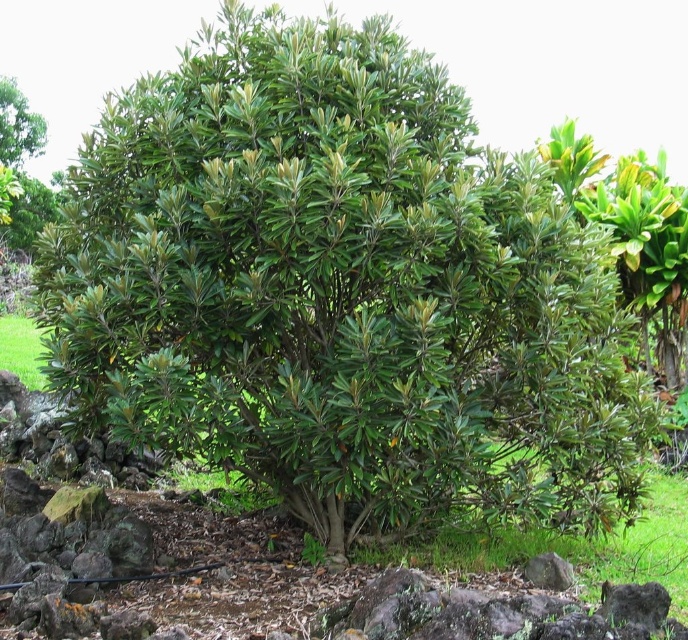
Does point (621, 618) come in front of point (570, 579)?

That is True.

Who is taller, gray rock at lower right or gray rough stone at lower center?

gray rock at lower right

You are a GUI agent. You are given a task and a screenshot of the screen. Output one action in this format:
    pyautogui.click(x=<x>, y=<y>)
    Task: Click on the gray rock at lower right
    This screenshot has height=640, width=688.
    Given the screenshot: What is the action you would take?
    pyautogui.click(x=634, y=604)

Which is behind, point (21, 122) or point (656, 586)?

Point (21, 122)

Between green leafy bush at upper left and gray rock at lower right, which one has less height?

With less height is gray rock at lower right.

At what (x,y) coordinates should I click in order to perform the action: click on green leafy bush at upper left. Please return your answer as a coordinate pair (x, y). Image resolution: width=688 pixels, height=640 pixels. Looking at the image, I should click on (19, 125).

Between green leafy bush at upper left and gray rough stone at lower center, which one is positioned higher?

green leafy bush at upper left

Is green leafy bush at upper left below gray rough stone at lower center?

Incorrect, green leafy bush at upper left is not positioned below gray rough stone at lower center.

Is point (14, 134) more distant than point (533, 573)?

Yes, point (14, 134) is farther from viewer.

Identify the location of green leafy bush at upper left. (x=19, y=125).